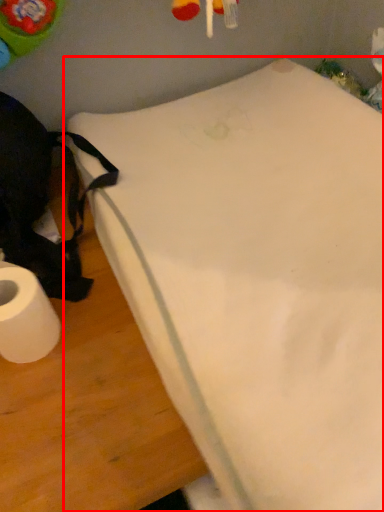
Question: From the image's perspective, considering the relative positions of furniture (annotated by the red box) and toilet paper in the image provided, where is furniture (annotated by the red box) located with respect to the staircase?

Choices:
 (A) above
 (B) below

Answer: (A)